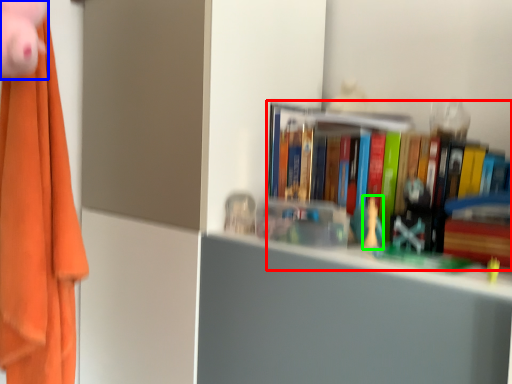
Question: Which object is positioned farthest from book (highlighted by a red box)? Select from toy (highlighted by a blue box) and toy (highlighted by a green box).

Choices:
 (A) toy
 (B) toy

Answer: (A)